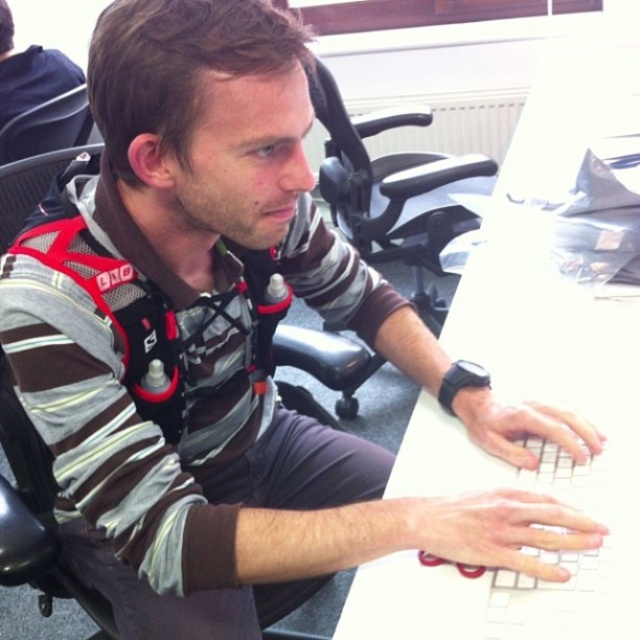
Who is positioned more to the left, white plastic keyboard at center or matte black shirt at upper left?

From the viewer's perspective, matte black shirt at upper left appears more on the left side.

Is white plastic keyboard at center to the left of matte black shirt at upper left from the viewer's perspective?

In fact, white plastic keyboard at center is to the right of matte black shirt at upper left.

Does point (608, 289) come behind point (49, 74)?

No, (608, 289) is closer to viewer.

Locate an element on the screen. Image resolution: width=640 pixels, height=640 pixels. white plastic keyboard at center is located at coordinates (531, 387).

Which is behind, point (524, 204) or point (67, 586)?

The point (524, 204) is behind.

Does white plastic keyboard at center have a lesser width compared to black plastic chair at center?

No.

What do you see at coordinates (531, 387) in the screenshot? Image resolution: width=640 pixels, height=640 pixels. I see `white plastic keyboard at center` at bounding box center [531, 387].

Image resolution: width=640 pixels, height=640 pixels. Identify the location of white plastic keyboard at center. (531, 387).

Does black plastic swivel chair at center appear over matte black shirt at upper left?

No, black plastic swivel chair at center is not above matte black shirt at upper left.

Can you confirm if black plastic swivel chair at center is positioned below matte black shirt at upper left?

Correct, black plastic swivel chair at center is located below matte black shirt at upper left.

Locate an element on the screen. black plastic swivel chair at center is located at coordinates (394, 192).